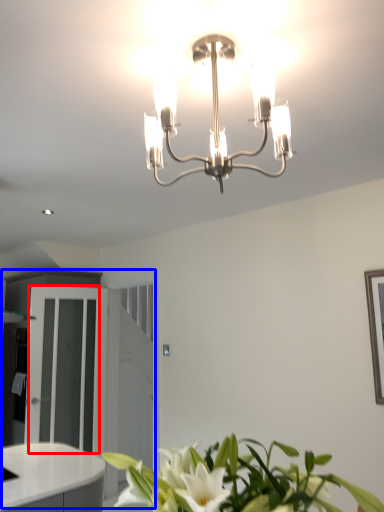
Question: Which point is further to the camera, glass door (highlighted by a red box) or dresser (highlighted by a blue box)?

Choices:
 (A) glass door
 (B) dresser

Answer: (B)